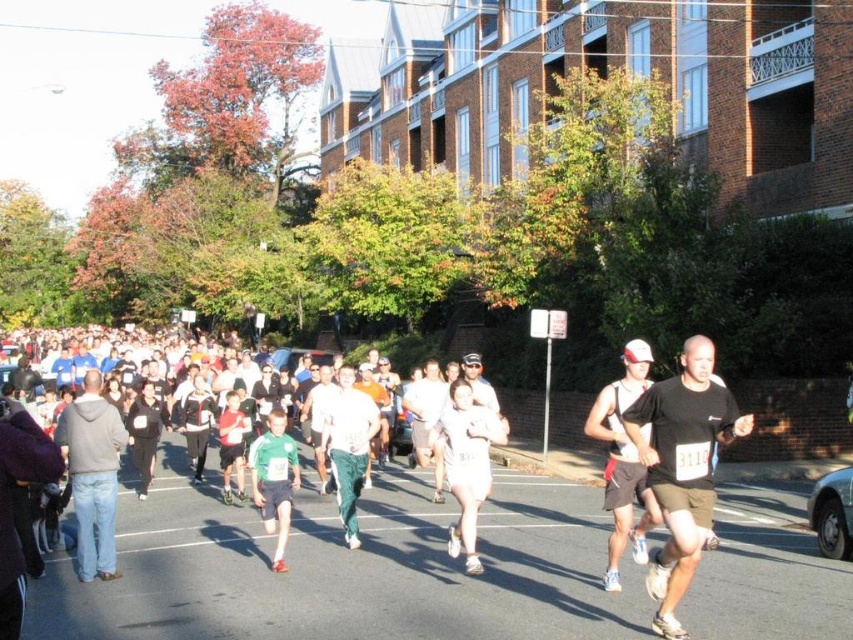
Question: Estimate the real-world distances between objects in this image. Which object is farther from the gray hoodie at left?

Choices:
 (A) green fabric pants at center
 (B) black matte shirt at center
 (C) matte black tank top at center
 (D) green fabric shorts at center

Answer: (C)

Question: Considering the real-world distances, which object is closest to the black matte shirt at center?

Choices:
 (A) matte black tank top at center
 (B) gray hoodie at left
 (C) green fabric shorts at center

Answer: (A)

Question: Considering the relative positions of black matte shirt at center and green fabric pants at center in the image provided, where is black matte shirt at center located with respect to green fabric pants at center?

Choices:
 (A) left
 (B) right

Answer: (B)

Question: Can you confirm if black matte shirt at center is positioned below green fabric shorts at center?

Choices:
 (A) no
 (B) yes

Answer: (A)

Question: Considering the real-world distances, which object is farthest from the matte black tank top at center?

Choices:
 (A) gray hoodie at left
 (B) black matte shirt at center

Answer: (A)

Question: Is black matte shirt at center positioned before green fabric pants at center?

Choices:
 (A) yes
 (B) no

Answer: (A)